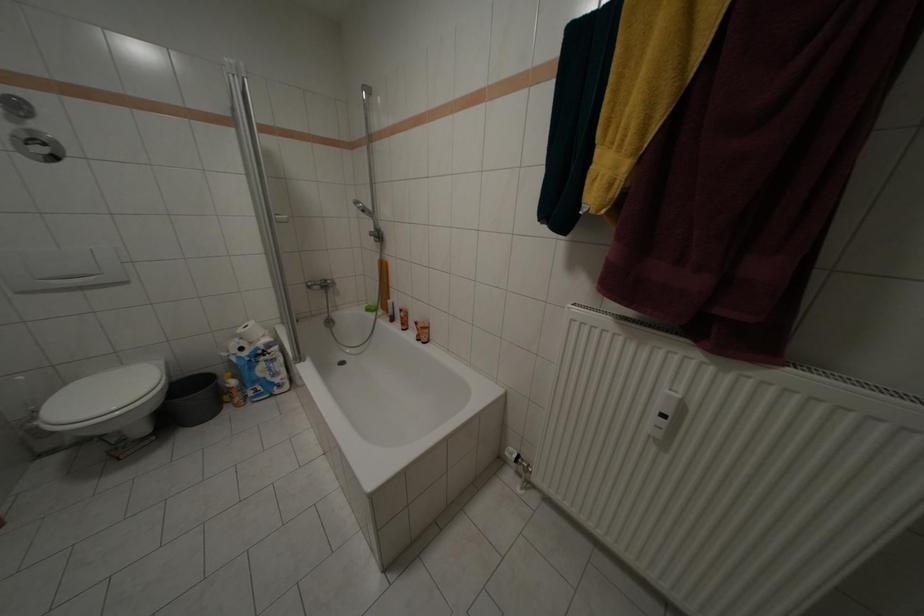
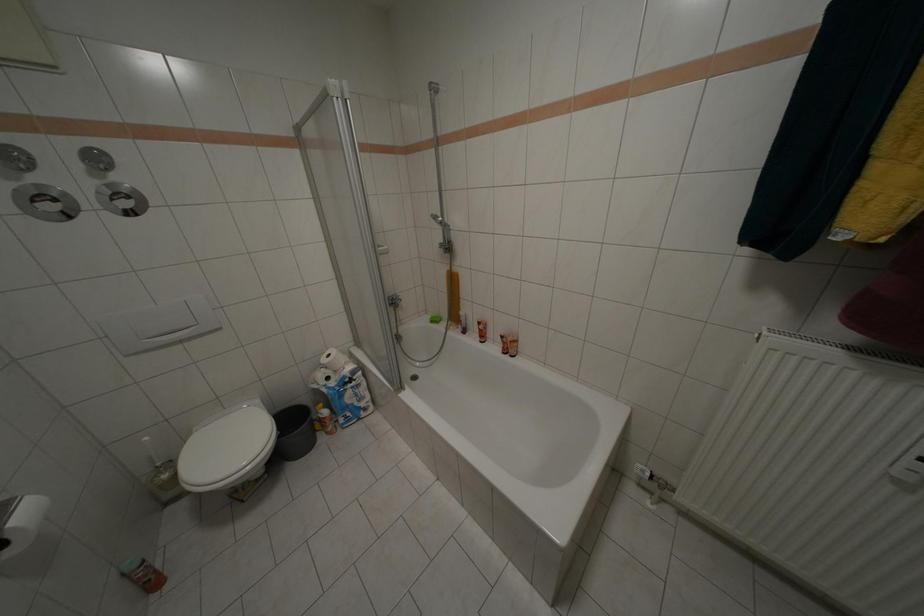
Question: Which direction would the cameraman need to move to produce the second image? Reply with the corresponding letter.

Choices:
 (A) Left
 (B) Right
 (C) Forward
 (D) Backward

Answer: (A)